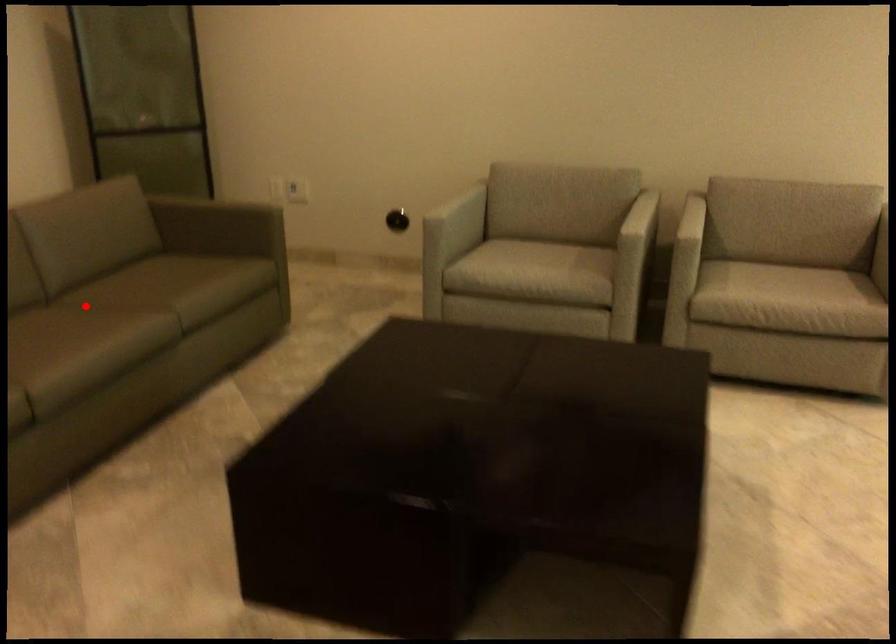
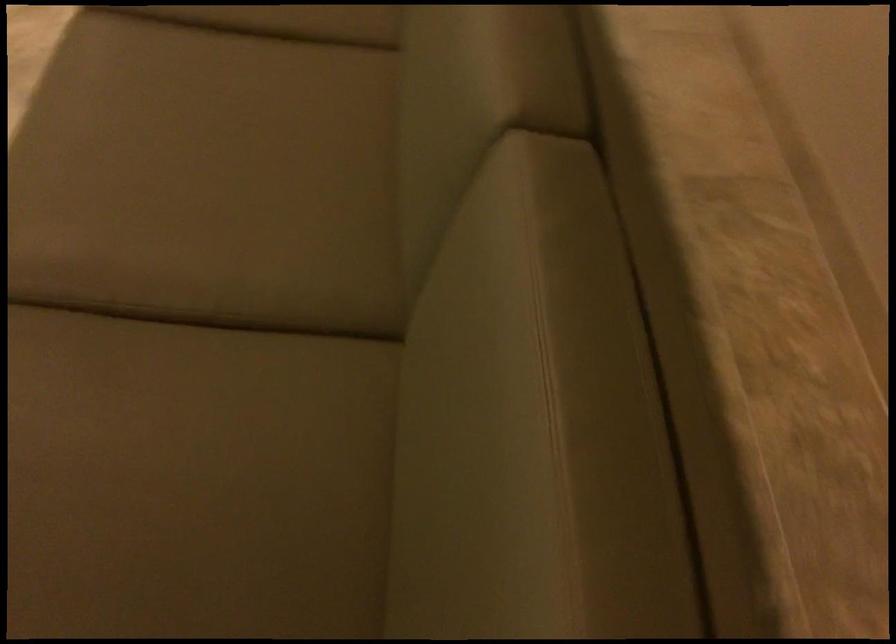
In the second image, find the point that corresponds to the highlighted location in the first image.

(211, 339)